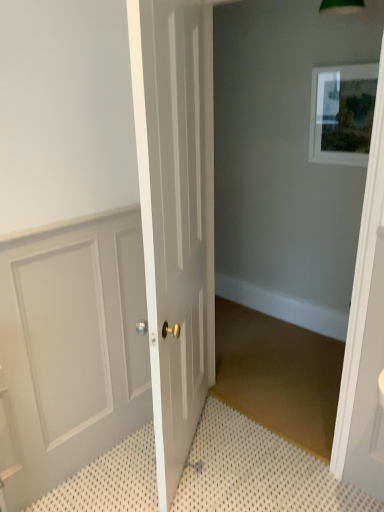
This screenshot has height=512, width=384. What do you see at coordinates (70, 350) in the screenshot? I see `white panelled door at left, marked as the second door in a right-to-left arrangement` at bounding box center [70, 350].

The width and height of the screenshot is (384, 512). I want to click on white glossy door at center, the second door positioned from the left, so click(176, 215).

What do you see at coordinates (176, 215) in the screenshot? I see `white glossy door at center, the second door positioned from the left` at bounding box center [176, 215].

Measure the distance between point (x=204, y=440) and camera.

The distance of point (x=204, y=440) from camera is 7.07 feet.

I want to click on white panelled door at left, positioned as the first door in left-to-right order, so click(70, 350).

From a real-world perspective, is matte white picture frame at upper right on top of white panelled door at left, marked as the second door in a right-to-left arrangement?

Yes, from a real-world perspective, matte white picture frame at upper right is over white panelled door at left, marked as the second door in a right-to-left arrangement

Which is in front, point (347, 108) or point (141, 249)?

The point (141, 249) is closer to the camera.

Which of these two, matte white picture frame at upper right or white panelled door at left, positioned as the first door in left-to-right order, stands shorter?

With less height is matte white picture frame at upper right.

Is matte white picture frame at upper right facing away from white panelled door at left, positioned as the first door in left-to-right order?

No, matte white picture frame at upper right is not facing the opposite direction of white panelled door at left, positioned as the first door in left-to-right order.

Is white panelled door at left, marked as the second door in a right-to-left arrangement, outside of matte white picture frame at upper right?

That's correct, white panelled door at left, marked as the second door in a right-to-left arrangement, is outside of matte white picture frame at upper right.

From a real-world perspective, is white panelled door at left, positioned as the first door in left-to-right order, below matte white picture frame at upper right?

Indeed, from a real-world perspective, white panelled door at left, positioned as the first door in left-to-right order, is positioned beneath matte white picture frame at upper right.

Is matte white picture frame at upper right at the back of white panelled door at left, positioned as the first door in left-to-right order?

No, white panelled door at left, positioned as the first door in left-to-right order, is not facing away from matte white picture frame at upper right.

Between white panelled door at left, positioned as the first door in left-to-right order, and matte white picture frame at upper right, which one has smaller size?

Smaller between the two is matte white picture frame at upper right.

Based on the photo, how many degrees apart are the facing directions of white textured bath mat at lower left and white glossy door at center, the second door positioned from the left?

61.3 degrees separate the facing orientations of white textured bath mat at lower left and white glossy door at center, the second door positioned from the left.

Which object is thinner, white textured bath mat at lower left or white glossy door at center, the second door positioned from the left?

With smaller width is white glossy door at center, the second door positioned from the left.

Considering the positions of objects white textured bath mat at lower left and white glossy door at center, the first door positioned from the right, in the image provided, who is more to the left, white textured bath mat at lower left or white glossy door at center, the first door positioned from the right,?

white glossy door at center, the first door positioned from the right, is more to the left.

Is white textured bath mat at lower left positioned far away from white glossy door at center, the first door positioned from the right?

No, white textured bath mat at lower left is in close proximity to white glossy door at center, the first door positioned from the right.

Is point (334, 510) closer to viewer compared to point (314, 80)?

That is True.

Are white textured bath mat at lower left and matte white picture frame at upper right beside each other?

There is a gap between white textured bath mat at lower left and matte white picture frame at upper right.

Is white textured bath mat at lower left surrounding matte white picture frame at upper right?

That's incorrect, matte white picture frame at upper right is not inside white textured bath mat at lower left.

Considering the relative positions of white textured bath mat at lower left and matte white picture frame at upper right in the image provided, is white textured bath mat at lower left to the right of matte white picture frame at upper right from the viewer's perspective?

In fact, white textured bath mat at lower left is to the left of matte white picture frame at upper right.

Locate an element on the screen. This screenshot has width=384, height=512. the 2nd door in front of the matte white picture frame at upper right, starting your count from the anchor is located at coordinates (176, 215).

In the scene shown: Is white glossy door at center, the first door positioned from the right, far away from matte white picture frame at upper right?

Absolutely, white glossy door at center, the first door positioned from the right, is distant from matte white picture frame at upper right.

Looking at their sizes, would you say white glossy door at center, the first door positioned from the right, is wider or thinner than matte white picture frame at upper right?

white glossy door at center, the first door positioned from the right, is wider than matte white picture frame at upper right.

Is white textured bath mat at lower left completely or partially inside white panelled door at left, positioned as the first door in left-to-right order?

No, white textured bath mat at lower left is located outside of white panelled door at left, positioned as the first door in left-to-right order.

Which object is positioned more to the left, white panelled door at left, positioned as the first door in left-to-right order, or white textured bath mat at lower left?

Positioned to the left is white panelled door at left, positioned as the first door in left-to-right order.

Between white panelled door at left, marked as the second door in a right-to-left arrangement, and white textured bath mat at lower left, which one has less height?

white textured bath mat at lower left.

Considering the relative sizes of white glossy door at center, the second door positioned from the left, and white panelled door at left, marked as the second door in a right-to-left arrangement, in the image provided, is white glossy door at center, the second door positioned from the left, taller than white panelled door at left, marked as the second door in a right-to-left arrangement,?

Indeed, white glossy door at center, the second door positioned from the left, has a greater height compared to white panelled door at left, marked as the second door in a right-to-left arrangement.

Considering the relative sizes of white glossy door at center, the second door positioned from the left, and white panelled door at left, positioned as the first door in left-to-right order, in the image provided, is white glossy door at center, the second door positioned from the left, wider than white panelled door at left, positioned as the first door in left-to-right order,?

Correct, the width of white glossy door at center, the second door positioned from the left, exceeds that of white panelled door at left, positioned as the first door in left-to-right order.

Considering the relative sizes of white glossy door at center, the first door positioned from the right, and white panelled door at left, positioned as the first door in left-to-right order, in the image provided, is white glossy door at center, the first door positioned from the right, smaller than white panelled door at left, positioned as the first door in left-to-right order,?

Incorrect, white glossy door at center, the first door positioned from the right, is not smaller in size than white panelled door at left, positioned as the first door in left-to-right order.

From a real-world perspective, is white glossy door at center, the second door positioned from the left, over white panelled door at left, positioned as the first door in left-to-right order?

Indeed, from a real-world perspective, white glossy door at center, the second door positioned from the left, stands above white panelled door at left, positioned as the first door in left-to-right order.

Locate an element on the screen. picture frame above the white panelled door at left, marked as the second door in a right-to-left arrangement (from the image's perspective) is located at coordinates [x=342, y=114].

You are a GUI agent. You are given a task and a screenshot of the screen. Output one action in this format:
    pyautogui.click(x=<x>, y=<y>)
    Task: Click on the 1st door in front of the matte white picture frame at upper right
    This screenshot has height=512, width=384.
    Given the screenshot: What is the action you would take?
    pyautogui.click(x=70, y=350)

Which object lies nearer to the anchor point matte white picture frame at upper right, white glossy door at center, the second door positioned from the left, or white panelled door at left, marked as the second door in a right-to-left arrangement?

The object closer to matte white picture frame at upper right is white glossy door at center, the second door positioned from the left.

Looking at the image, which one is located closer to matte white picture frame at upper right, white textured bath mat at lower left or white glossy door at center, the second door positioned from the left?

white glossy door at center, the second door positioned from the left, lies closer to matte white picture frame at upper right than the other object.

In the scene shown: When comparing their distances from white panelled door at left, marked as the second door in a right-to-left arrangement, does matte white picture frame at upper right or white glossy door at center, the second door positioned from the left, seem closer?

The object closer to white panelled door at left, marked as the second door in a right-to-left arrangement, is white glossy door at center, the second door positioned from the left.

When comparing their distances from matte white picture frame at upper right, does white textured bath mat at lower left or white panelled door at left, positioned as the first door in left-to-right order, seem closer?

Among the two, white panelled door at left, positioned as the first door in left-to-right order, is located nearer to matte white picture frame at upper right.

Based on their spatial positions, is white textured bath mat at lower left or white glossy door at center, the second door positioned from the left, further from white panelled door at left, positioned as the first door in left-to-right order?

white textured bath mat at lower left lies further to white panelled door at left, positioned as the first door in left-to-right order, than the other object.

When comparing their distances from white textured bath mat at lower left, does white glossy door at center, the first door positioned from the right, or matte white picture frame at upper right seem closer?

white glossy door at center, the first door positioned from the right, is closer to white textured bath mat at lower left.

Looking at the image, which one is located further to matte white picture frame at upper right, white panelled door at left, marked as the second door in a right-to-left arrangement, or white glossy door at center, the second door positioned from the left?

Based on the image, white panelled door at left, marked as the second door in a right-to-left arrangement, appears to be further to matte white picture frame at upper right.

Considering their positions, is white glossy door at center, the first door positioned from the right, positioned closer to white panelled door at left, positioned as the first door in left-to-right order, than matte white picture frame at upper right?

white glossy door at center, the first door positioned from the right, is closer to white panelled door at left, positioned as the first door in left-to-right order.

Find the location of `door between white panelled door at left, marked as the second door in a right-to-left arrangement, and matte white picture frame at upper right`. door between white panelled door at left, marked as the second door in a right-to-left arrangement, and matte white picture frame at upper right is located at coordinates (176, 215).

The height and width of the screenshot is (512, 384). I want to click on door between white glossy door at center, the first door positioned from the right, and white textured bath mat at lower left vertically, so click(70, 350).